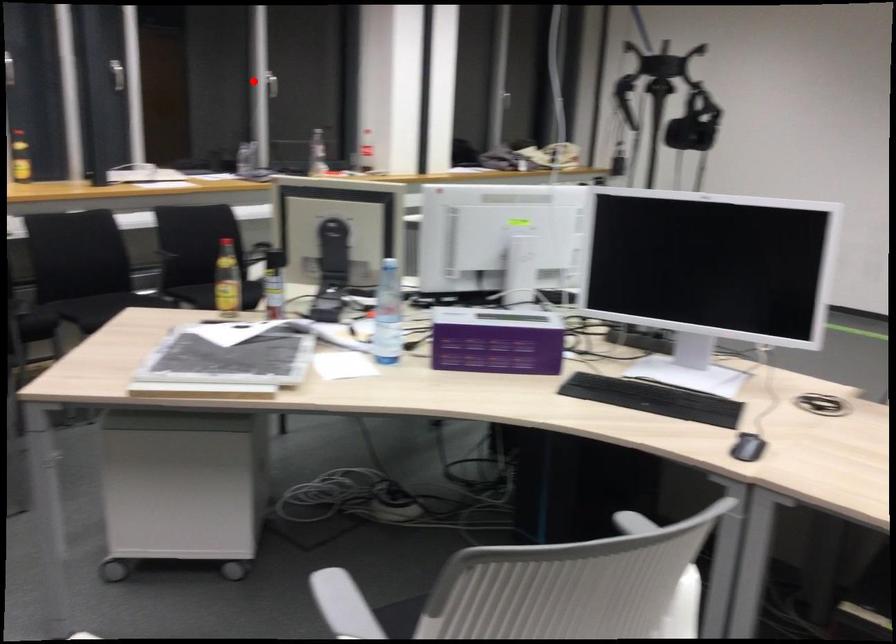
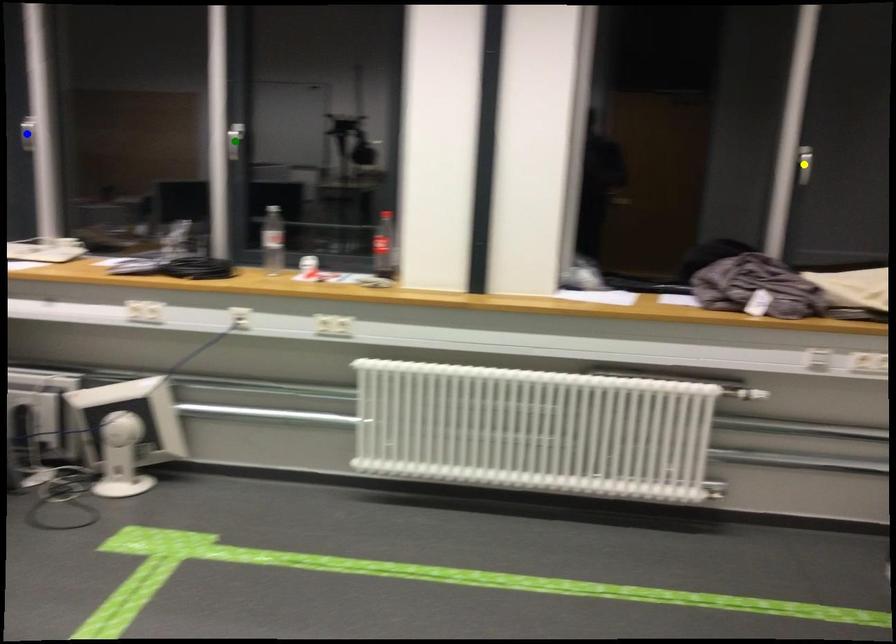
Question: I am providing you with two images of the same scene from different viewpoints. A red point is marked on the first image. You are given multiple points on the second image. Which point in image 2 is actually the same real-world point as the red point in image 1?

Choices:
 (A) green point
 (B) blue point
 (C) yellow point

Answer: (A)